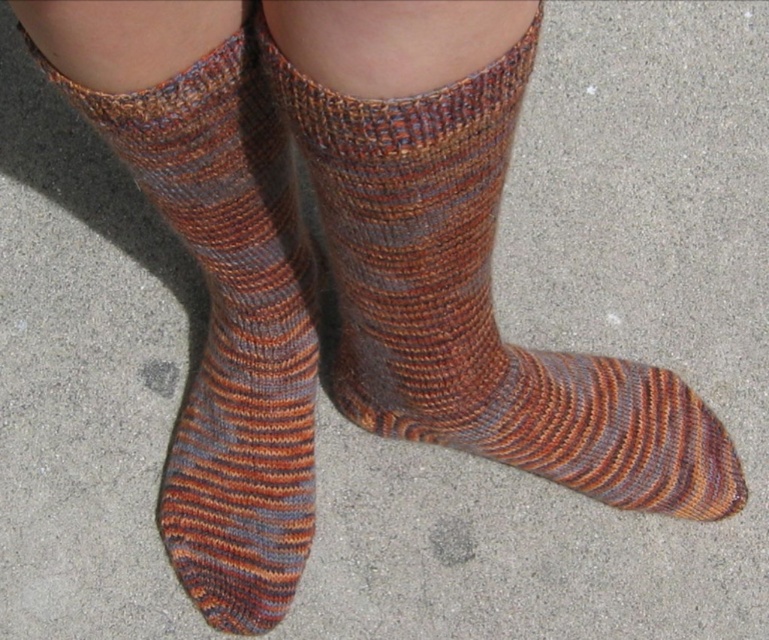
In the scene shown: Does striped wool sock at center appear over multicolored knitted sock at center?

Correct, striped wool sock at center is located above multicolored knitted sock at center.

In order to click on striped wool sock at center in this screenshot , I will do `click(475, 298)`.

Find the location of a particular element. striped wool sock at center is located at coordinates (475, 298).